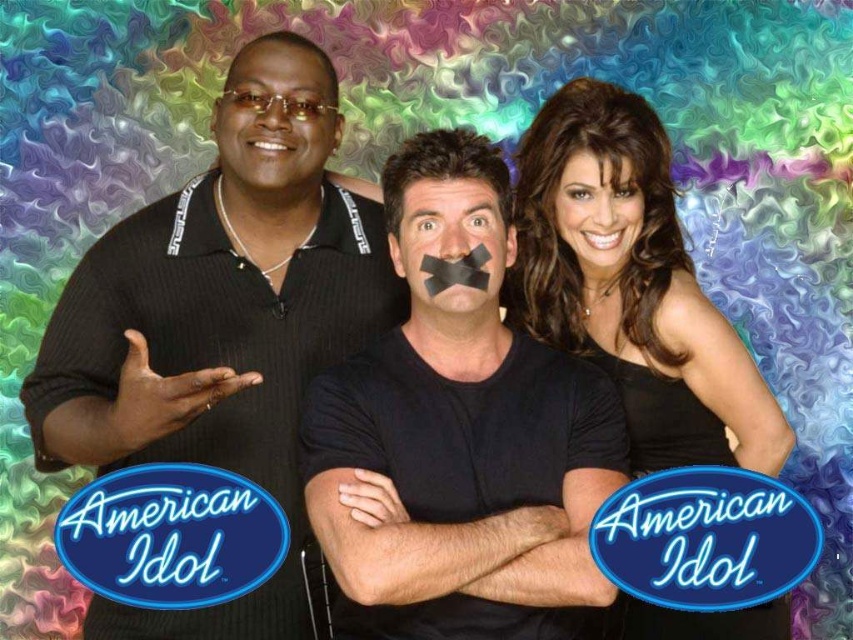
In the scene shown: You are standing in front of the three people in the image. You want to place a small sticker on the exact midpoint between point (262, 305) and point (527, 580). Will the sticker be closer to the person on the left or the person on the right?

The sticker will be closer to the person on the right because the midpoint between point (262, 305) and point (527, 580) is closer to the latter point, which is located near the right side of the image.

You are a photographer setting up for a group photo. You have a black satin dress at center and a black matte tape at center in the scene. Based on the description, which object occupies more horizontal space in the image?

The black satin dress at center might be wider than black matte tape at center, so it likely occupies more horizontal space.